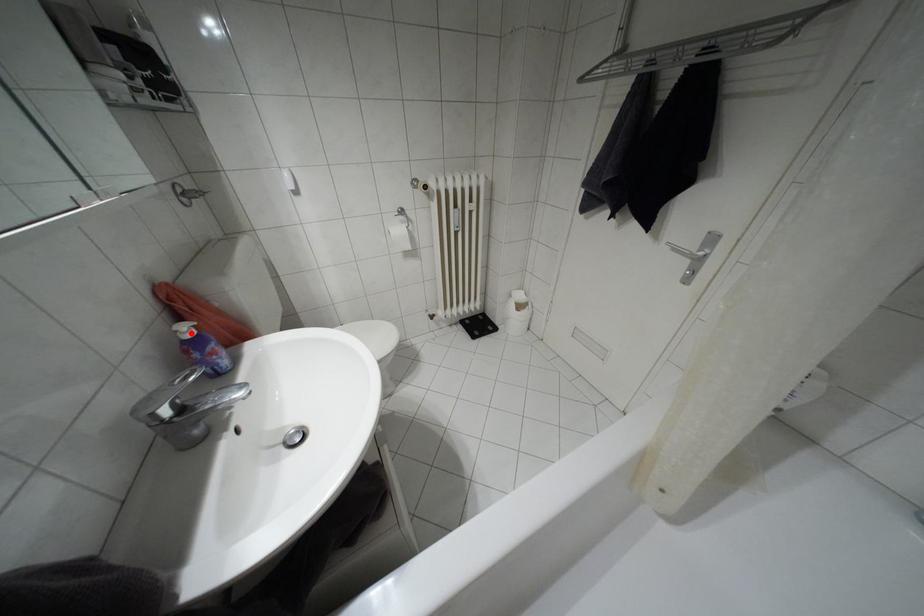
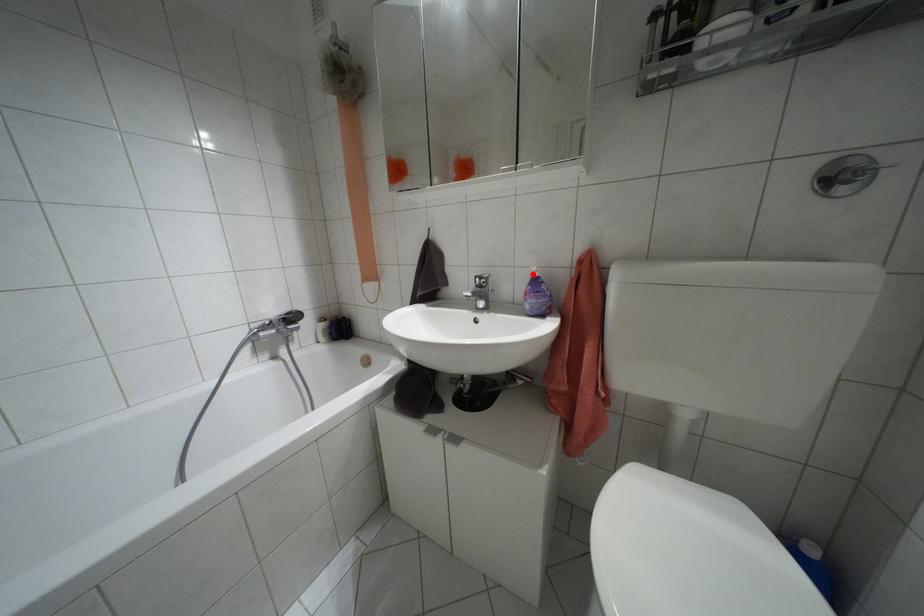
I am providing you with two images of the same scene from different viewpoints. A red point is marked on the first image and another point is marked on the second image. Is the red point in image1 aligned with the point shown in image2?

Yes